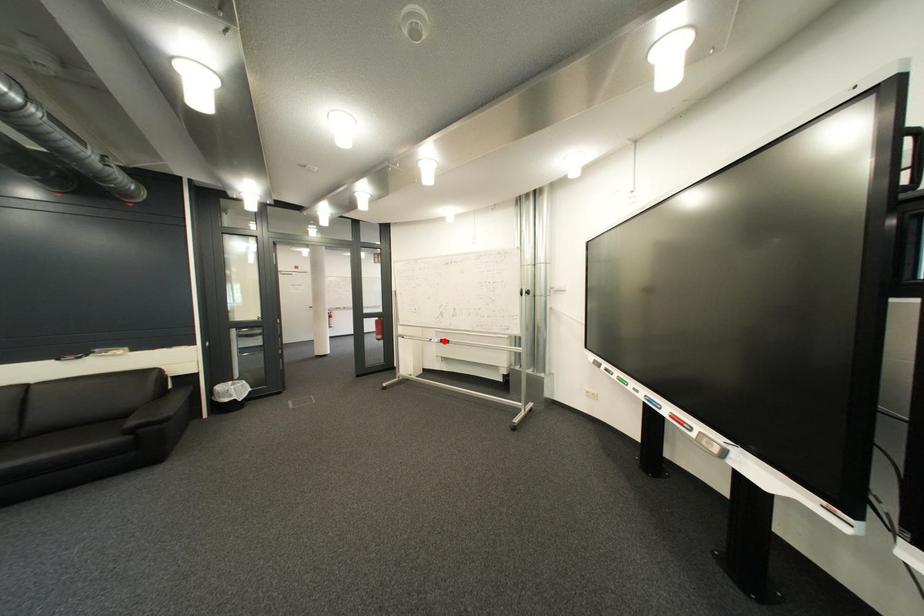
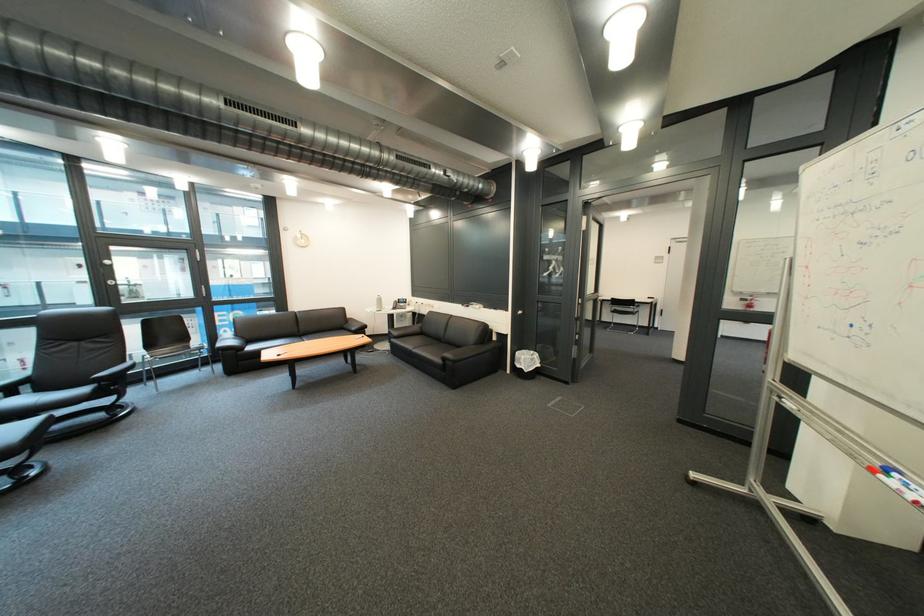
Locate, in the second image, the point that corresponds to the highlighted location in the first image.

(901, 472)